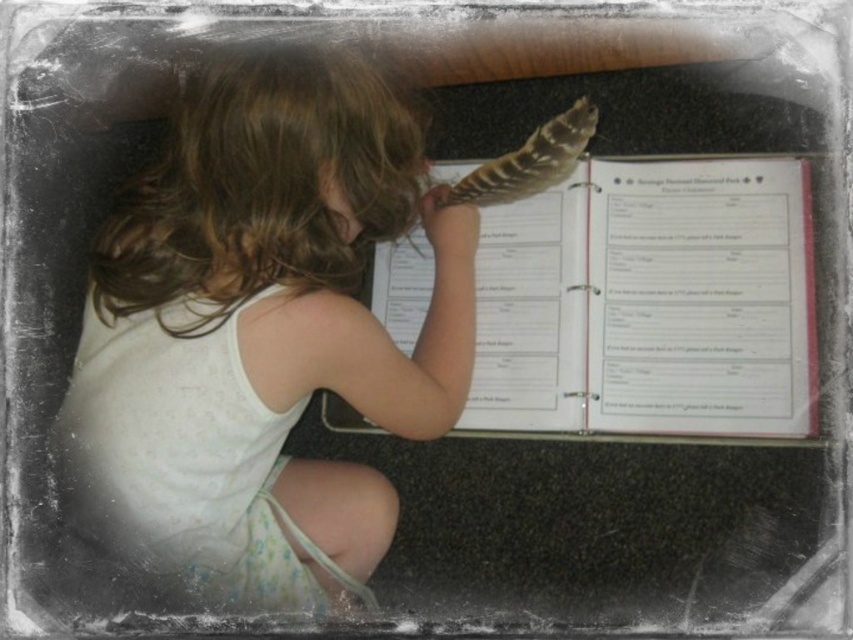
Question: Is white cotton shirt at center smaller than brown feather at upper center?

Choices:
 (A) no
 (B) yes

Answer: (A)

Question: Which point is closer to the camera?

Choices:
 (A) (575, 145)
 (B) (123, 244)

Answer: (B)

Question: Does white cotton shirt at center lie behind brown feather at upper center?

Choices:
 (A) yes
 (B) no

Answer: (B)

Question: From the image, what is the correct spatial relationship of white cotton shirt at center in relation to brown feather at upper center?

Choices:
 (A) right
 (B) left

Answer: (B)